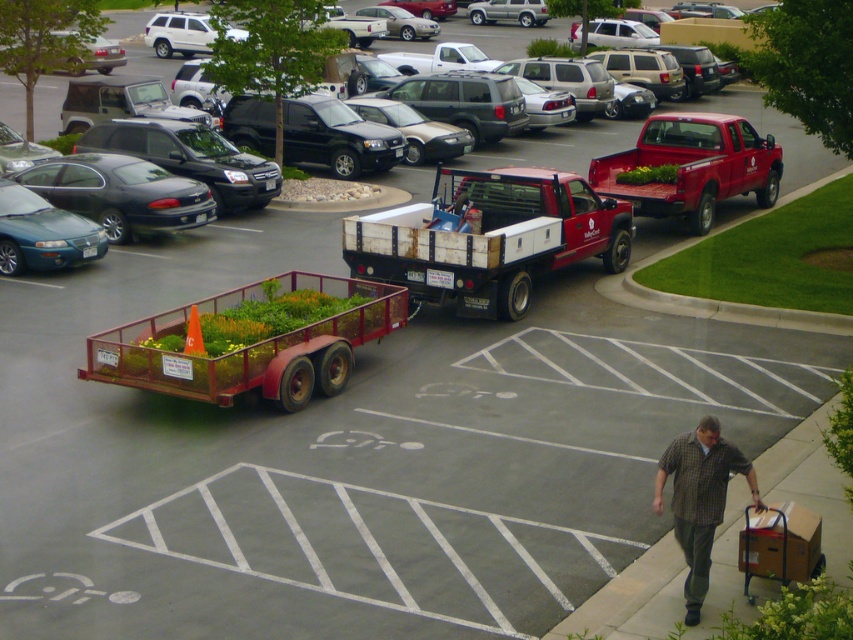
Does metallic red trailer at center have a smaller size compared to matte white truck at center?

Yes.

Is point (258, 316) less distant than point (757, 120)?

Yes, point (258, 316) is closer to viewer.

Describe the element at coordinates (251, 340) in the screenshot. The width and height of the screenshot is (853, 640). I see `metallic red trailer at center` at that location.

Where is `metallic red trailer at center`? This screenshot has width=853, height=640. metallic red trailer at center is located at coordinates (251, 340).

How much distance is there between matte white truck at center and matte black sedan at left?

The distance of matte white truck at center from matte black sedan at left is 7.76 meters.

Is point (138, 33) farther from viewer compared to point (15, 173)?

Yes, it is.

Where is `matte white truck at center`? matte white truck at center is located at coordinates (561, 145).

This screenshot has height=640, width=853. What are the coordinates of `matte white truck at center` in the screenshot? It's located at (561, 145).

Does metallic red trailer at center have a lesser width compared to matte red pickup truck at right?

No, metallic red trailer at center is not thinner than matte red pickup truck at right.

Can you confirm if metallic red trailer at center is positioned to the left of matte red pickup truck at right?

Correct, you'll find metallic red trailer at center to the left of matte red pickup truck at right.

Find the location of a particular element. The width and height of the screenshot is (853, 640). metallic red trailer at center is located at coordinates (251, 340).

Locate an element on the screen. The image size is (853, 640). metallic red trailer at center is located at coordinates (251, 340).